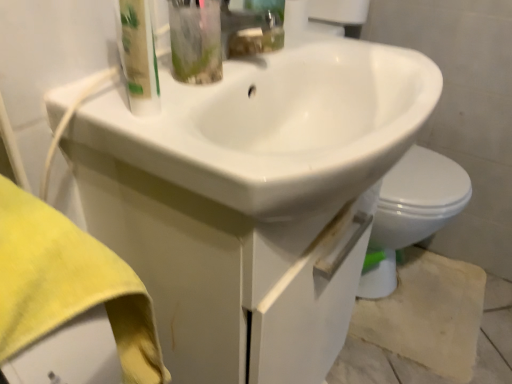
Locate an element on the screen. The width and height of the screenshot is (512, 384). empty space that is ontop of beige textured concrete at lower right (from a real-world perspective) is located at coordinates (426, 298).